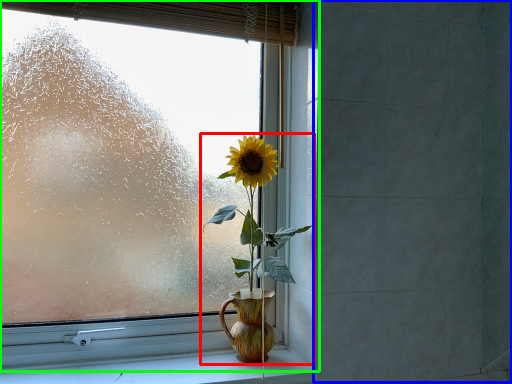
Question: Based on their relative distances, which object is nearer to houseplant (highlighted by a red box)? Choose from backdrop (highlighted by a blue box) and window (highlighted by a green box).

Choices:
 (A) backdrop
 (B) window

Answer: (B)